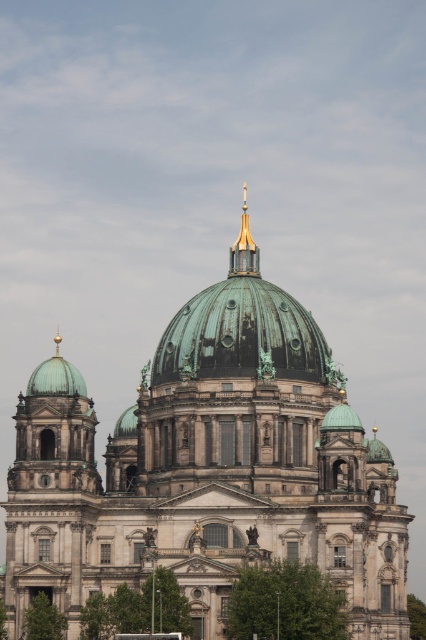
You are an architect assessing the structural integrity of the building. You need to determine which object between the green copper dome at center and the gold polished metal spire at upper center has a greater width to ensure proper load distribution. Which one is wider?

The green copper dome at center has a greater width than the gold polished metal spire at upper center.

You are an architect examining the building. You notice the green copper dome at center and the gold polished metal spire at upper center. Which of these two objects is bigger in size?

The green copper dome at center has a larger size compared to the gold polished metal spire at upper center.

You are an architect analyzing the building. Which object, the green copper dome at center or the gold polished metal spire at upper center, has a greater height?

The green copper dome at center is much taller than the gold polished metal spire at upper center.